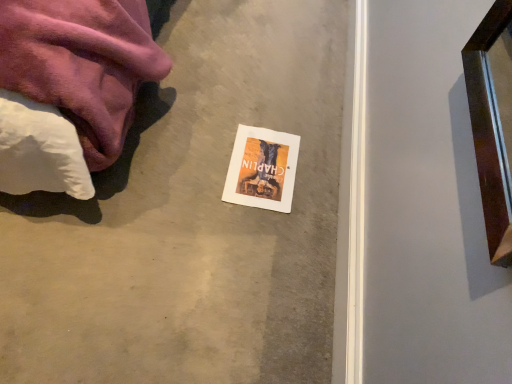
In order to click on orange matte paper flyer at center in this screenshot , I will do `click(262, 169)`.

What do you see at coordinates (262, 169) in the screenshot?
I see `orange matte paper flyer at center` at bounding box center [262, 169].

You are a GUI agent. You are given a task and a screenshot of the screen. Output one action in this format:
    pyautogui.click(x=<x>, y=<y>)
    Task: Click on the smooth concrete at center
    This screenshot has width=512, height=384.
    Given the screenshot: What is the action you would take?
    pyautogui.click(x=191, y=220)

The image size is (512, 384). What do you see at coordinates (191, 220) in the screenshot?
I see `smooth concrete at center` at bounding box center [191, 220].

The height and width of the screenshot is (384, 512). Find the location of `orange matte paper flyer at center`. orange matte paper flyer at center is located at coordinates tap(262, 169).

Would you say orange matte paper flyer at center is to the left or to the right of smooth concrete at center in the picture?

Clearly, orange matte paper flyer at center is on the right of smooth concrete at center in the image.

Does orange matte paper flyer at center come in front of smooth concrete at center?

No, orange matte paper flyer at center is further to the viewer.

Considering the positions of point (242, 174) and point (288, 241), is point (242, 174) closer or farther from the camera than point (288, 241)?

Point (242, 174) is positioned farther from the camera compared to point (288, 241).

From the image's perspective, is orange matte paper flyer at center below smooth concrete at center?

Yes.

From a real-world perspective, who is located lower, orange matte paper flyer at center or smooth concrete at center?

smooth concrete at center, from a real-world perspective.

In terms of width, does orange matte paper flyer at center look wider or thinner when compared to smooth concrete at center?

Clearly, orange matte paper flyer at center has less width compared to smooth concrete at center.

From their relative heights in the image, would you say orange matte paper flyer at center is taller or shorter than smooth concrete at center?

Considering their sizes, orange matte paper flyer at center has less height than smooth concrete at center.

Which of these two, orange matte paper flyer at center or smooth concrete at center, is bigger?

With larger size is smooth concrete at center.

Is orange matte paper flyer at center inside or outside of smooth concrete at center?

orange matte paper flyer at center is spatially positioned inside smooth concrete at center.

Are orange matte paper flyer at center and smooth concrete at center beside each other?

They are not placed beside each other.

Is orange matte paper flyer at center positioned with its back to smooth concrete at center?

Yes, orange matte paper flyer at center is positioned with its back facing smooth concrete at center.

Consider the image. What's the angular difference between orange matte paper flyer at center and smooth concrete at center's facing directions?

The facing directions of orange matte paper flyer at center and smooth concrete at center are 92 degrees apart.

Measure the distance between orange matte paper flyer at center and smooth concrete at center.

orange matte paper flyer at center is 7.74 inches away from smooth concrete at center.

The image size is (512, 384). Identify the location of concrete in front of the orange matte paper flyer at center. (191, 220).

Is smooth concrete at center at the right side of orange matte paper flyer at center?

No, smooth concrete at center is not to the right of orange matte paper flyer at center.

Which is in front, smooth concrete at center or orange matte paper flyer at center?

smooth concrete at center is closer to the camera.

Considering the points (205, 229) and (258, 179), which point is in front, point (205, 229) or point (258, 179)?

The point (205, 229) is closer.

From the image's perspective, is smooth concrete at center positioned above or below orange matte paper flyer at center?

smooth concrete at center is above orange matte paper flyer at center.

In the scene shown: From a real-world perspective, who is located lower, smooth concrete at center or orange matte paper flyer at center?

smooth concrete at center.

Is smooth concrete at center thinner than orange matte paper flyer at center?

In fact, smooth concrete at center might be wider than orange matte paper flyer at center.

Considering the relative sizes of smooth concrete at center and orange matte paper flyer at center in the image provided, is smooth concrete at center shorter than orange matte paper flyer at center?

No.

In the scene shown: Who is smaller, smooth concrete at center or orange matte paper flyer at center?

Smaller between the two is orange matte paper flyer at center.

Is smooth concrete at center completely or partially outside of orange matte paper flyer at center?

Yes, smooth concrete at center is outside of orange matte paper flyer at center.

Is smooth concrete at center placed right next to orange matte paper flyer at center?

No, smooth concrete at center is not touching orange matte paper flyer at center.

Looking at this image, is smooth concrete at center facing away from orange matte paper flyer at center?

No.

Find the location of a particular element. The width and height of the screenshot is (512, 384). flyer behind the smooth concrete at center is located at coordinates (262, 169).

Where is `concrete on the left of the orange matte paper flyer at center`? The width and height of the screenshot is (512, 384). concrete on the left of the orange matte paper flyer at center is located at coordinates (191, 220).

Where is `flyer that is behind the smooth concrete at center`? This screenshot has width=512, height=384. flyer that is behind the smooth concrete at center is located at coordinates (262, 169).